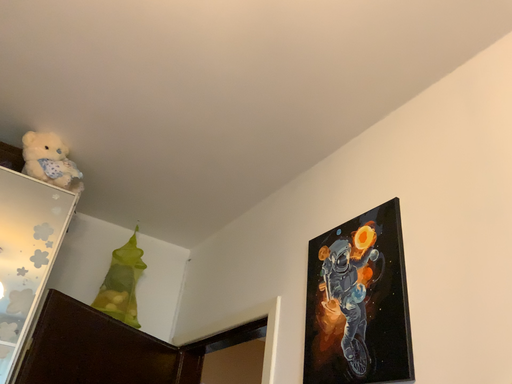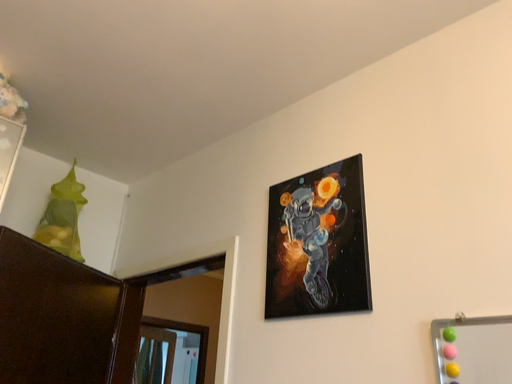
Question: Which way did the camera rotate in the video?

Choices:
 (A) rotated right
 (B) rotated left

Answer: (A)